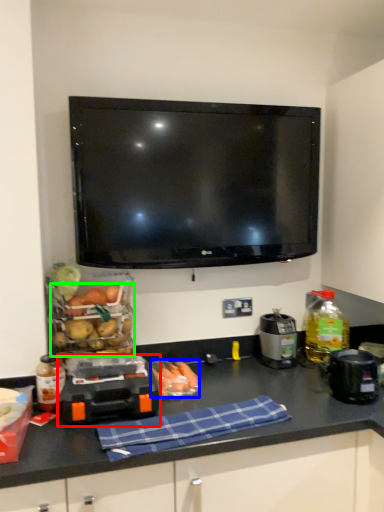
Question: Which object is the farthest from appliance (highlighted by a red box)? Choose among these: food (highlighted by a blue box) or food (highlighted by a green box).

Choices:
 (A) food
 (B) food

Answer: (B)